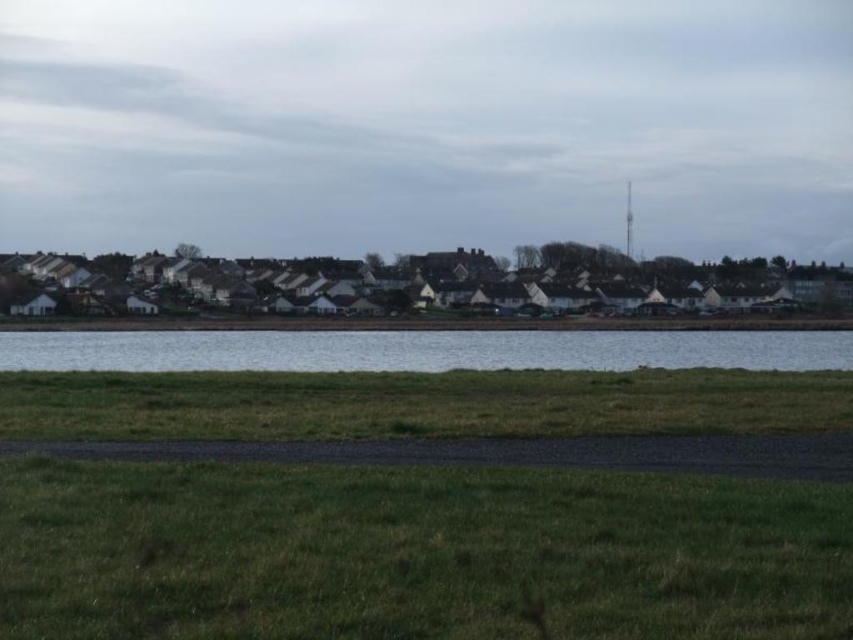
Question: Does green grass at lower center have a greater width compared to clear water at center?

Choices:
 (A) no
 (B) yes

Answer: (A)

Question: Which point appears closest to the camera in this image?

Choices:
 (A) (190, 532)
 (B) (206, 356)

Answer: (A)

Question: Does green grass at lower center appear on the left side of clear water at center?

Choices:
 (A) yes
 (B) no

Answer: (A)

Question: Does green grass at lower center have a greater width compared to clear water at center?

Choices:
 (A) yes
 (B) no

Answer: (B)

Question: Which point is closer to the camera?

Choices:
 (A) green grass at lower center
 (B) clear water at center

Answer: (A)

Question: Which of the following is the farthest from the observer?

Choices:
 (A) clear water at center
 (B) green grass at lower center

Answer: (A)